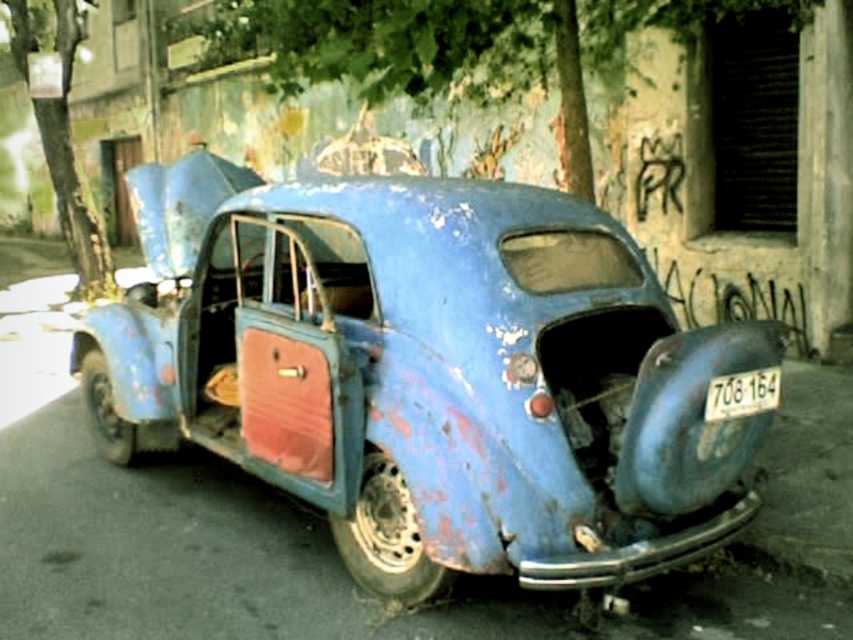
Can you confirm if rusty blue car at center is positioned above white plastic license plate at center?

Correct, rusty blue car at center is located above white plastic license plate at center.

Is rusty blue car at center to the right of white plastic license plate at center from the viewer's perspective?

Incorrect, rusty blue car at center is not on the right side of white plastic license plate at center.

Measure the distance between point (630, 538) and camera.

4.21 meters

Identify the location of rusty blue car at center. (428, 372).

Can you confirm if rusty blue car at center is bigger than green leafy tree at upper left?

Yes, rusty blue car at center is bigger than green leafy tree at upper left.

Which is more to the left, rusty blue car at center or green leafy tree at upper left?

Positioned to the left is green leafy tree at upper left.

Image resolution: width=853 pixels, height=640 pixels. I want to click on rusty blue car at center, so click(428, 372).

Is point (90, 204) positioned after point (733, 394)?

Yes, it is behind point (733, 394).

Consider the image. Is green leafy tree at upper left to the right of white plastic license plate at center from the viewer's perspective?

No, green leafy tree at upper left is not to the right of white plastic license plate at center.

Does point (68, 248) come farther from viewer compared to point (741, 380)?

Yes, point (68, 248) is farther from viewer.

Find the location of a particular element. The width and height of the screenshot is (853, 640). green leafy tree at upper left is located at coordinates click(x=73, y=163).